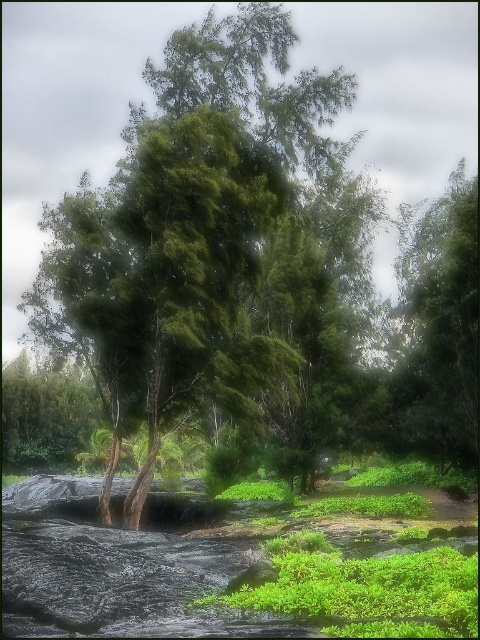
Consider the image. You are planning to set up a picnic blanket between the green leafy tree at center and the green leafy tree at right. The picnic blanket is 5 meters long. Will there be enough space between the two trees to place the blanket without it overlapping either tree?

The distance between the green leafy tree at center and the green leafy tree at right is 7.06 meters. Since the picnic blanket is 5 meters long, there will be enough space to place it between the two trees without overlapping either tree.

You are a hiker trying to navigate through the rocky terrain. You see the green leafy tree at center and the green mossy rock at lower center. Which object would block your path more if you were to walk straight ahead?

The green leafy tree at center is bigger than the green mossy rock at lower center, so it would block your path more if you were to walk straight ahead.